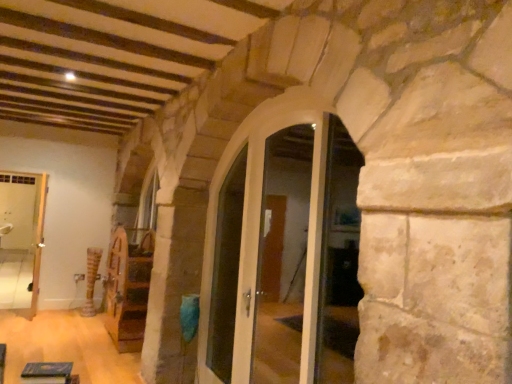
How much space does white glossy door at center, marked as the 2th glass door in a front-to-back arrangement, occupy vertically?

The height of white glossy door at center, marked as the 2th glass door in a front-to-back arrangement, is 1.97 meters.

What is the approximate width of wooden spinning wheel at center, placed as the second furniture when sorted from top to bottom?

wooden spinning wheel at center, placed as the second furniture when sorted from top to bottom, is 19.20 inches wide.

Consider the image. What is the approximate height of wooden spinning wheel at center, which is counted as the second furniture, starting from the front?

wooden spinning wheel at center, which is counted as the second furniture, starting from the front, is 1.34 meters tall.

In order to face clear glass door at center, which ranks as the second glass door in back-to-front order, should I rotate leftwards or rightwards?

Turn right by 0.703 degrees to look at clear glass door at center, which ranks as the second glass door in back-to-front order.

What do you see at coordinates (47, 373) in the screenshot? I see `green felt book at lower left, which ranks as the first furniture in top-to-bottom order` at bounding box center [47, 373].

What is the approximate width of green felt book at lower left, which ranks as the first furniture in top-to-bottom order?

13.06 inches.

What do you see at coordinates (21, 238) in the screenshot? I see `white glossy door at left` at bounding box center [21, 238].

Find the location of a particular element. This screenshot has width=512, height=384. white glossy door at left is located at coordinates (21, 238).

This screenshot has width=512, height=384. Identify the location of white glossy door at center, marked as the 2th glass door in a front-to-back arrangement. (283, 255).

What's the angular difference between wooden spinning wheel at center, placed as the first furniture when sorted from bottom to top, and wooden textured pillar at center's facing directions?

The facing directions of wooden spinning wheel at center, placed as the first furniture when sorted from bottom to top, and wooden textured pillar at center are 0.000208 degrees apart.

Considering the sizes of wooden spinning wheel at center, placed as the first furniture when sorted from bottom to top, and wooden textured pillar at center in the image, is wooden spinning wheel at center, placed as the first furniture when sorted from bottom to top, taller or shorter than wooden textured pillar at center?

Clearly, wooden spinning wheel at center, placed as the first furniture when sorted from bottom to top, is taller compared to wooden textured pillar at center.

Is the depth of wooden spinning wheel at center, which is counted as the second furniture, starting from the front, less than that of wooden textured pillar at center?

Yes.

Is wooden spinning wheel at center, positioned as the 1th furniture in back-to-front order, to the right of wooden textured pillar at center from the viewer's perspective?

Yes.

Is green felt book at lower left, which is counted as the 2th furniture, starting from the bottom, smaller than white glossy door at center?

Yes.

I want to click on the 1st furniture below the white glossy door at center (from the image's perspective), so click(x=47, y=373).

From the image's perspective, would you say green felt book at lower left, the second furniture when ordered from back to front, is positioned over white glossy door at center?

Actually, green felt book at lower left, the second furniture when ordered from back to front, appears below white glossy door at center in the image.

Is green felt book at lower left, which ranks as the first furniture in top-to-bottom order, not near white glossy door at center?

Yes, green felt book at lower left, which ranks as the first furniture in top-to-bottom order, is far from white glossy door at center.

Looking at this image, in the image, is wooden textured pillar at center on the left side or the right side of white glossy door at center, marked as the 2th glass door in a front-to-back arrangement?

In the image, wooden textured pillar at center appears on the left side of white glossy door at center, marked as the 2th glass door in a front-to-back arrangement.

Is wooden textured pillar at center placed right next to white glossy door at center, marked as the 2th glass door in a front-to-back arrangement?

No.

Between wooden textured pillar at center and white glossy door at center, the 1th glass door positioned from the back, which one has smaller width?

Thinner between the two is white glossy door at center, the 1th glass door positioned from the back.

Looking at this image, from a real-world perspective, is wooden textured pillar at center physically located above or below white glossy door at center, marked as the 2th glass door in a front-to-back arrangement?

From a real-world perspective, wooden textured pillar at center is physically below white glossy door at center, marked as the 2th glass door in a front-to-back arrangement.

Measure the distance from green felt book at lower left, which ranks as the first furniture in top-to-bottom order, to clear glass door at center, which ranks as the second glass door in back-to-front order.

A distance of 2.11 meters exists between green felt book at lower left, which ranks as the first furniture in top-to-bottom order, and clear glass door at center, which ranks as the second glass door in back-to-front order.

Does green felt book at lower left, which is counted as the 2th furniture, starting from the bottom, touch clear glass door at center, which appears as the 1th glass door when viewed from the front?

green felt book at lower left, which is counted as the 2th furniture, starting from the bottom, is not next to clear glass door at center, which appears as the 1th glass door when viewed from the front, and they're not touching.

Does point (49, 379) appear closer or farther from the camera than point (298, 334)?

Point (49, 379).

From the image's perspective, is wooden spinning wheel at center, positioned as the 1th furniture in back-to-front order, located beneath green felt book at lower left, which is counted as the 2th furniture, starting from the bottom?

Yes.

Which of these two, wooden spinning wheel at center, placed as the second furniture when sorted from top to bottom, or green felt book at lower left, the first furniture positioned from the front, is bigger?

wooden spinning wheel at center, placed as the second furniture when sorted from top to bottom.

How different are the orientations of wooden spinning wheel at center, positioned as the 1th furniture in back-to-front order, and green felt book at lower left, the second furniture when ordered from back to front, in degrees?

170 degrees.

In the scene shown: Between wooden spinning wheel at center, placed as the second furniture when sorted from top to bottom, and green felt book at lower left, the second furniture when ordered from back to front, which one has larger width?

With larger width is wooden spinning wheel at center, placed as the second furniture when sorted from top to bottom.

From the image's perspective, is white glossy door at center located above or below white glossy door at left?

white glossy door at center is situated higher than white glossy door at left in the image.

Based on the photo, is white glossy door at center at the right side of white glossy door at left?

Yes.

Which object is wider, white glossy door at center or white glossy door at left?

With larger width is white glossy door at center.

Is point (217, 294) positioned after point (30, 271)?

No, it is not.

Which point is more distant from viewer, (278, 334) or (92, 265)?

Point (92, 265)

Based on the photo, how different are the orientations of white glossy door at center, the 1th glass door positioned from the back, and wooden textured pillar at center in degrees?

The facing directions of white glossy door at center, the 1th glass door positioned from the back, and wooden textured pillar at center are 1.37 degrees apart.

Is wooden textured pillar at center inside white glossy door at center, marked as the 2th glass door in a front-to-back arrangement?

No, wooden textured pillar at center is not surrounded by white glossy door at center, marked as the 2th glass door in a front-to-back arrangement.

Is white glossy door at center, the 1th glass door positioned from the back, facing away from wooden textured pillar at center?

white glossy door at center, the 1th glass door positioned from the back, does not have its back to wooden textured pillar at center.

The height and width of the screenshot is (384, 512). In order to click on the 2nd furniture located above the wooden textured pillar at center (from a real-world perspective) in this screenshot , I will do `click(128, 287)`.

The width and height of the screenshot is (512, 384). There is a white glossy door at center. In order to click on the 1st furniture below it (from the image's perspective) in this screenshot , I will do `click(47, 373)`.

Consider the image. Based on their spatial positions, is wooden spinning wheel at center, placed as the second furniture when sorted from top to bottom, or white glossy door at center further from wooden textured pillar at center?

white glossy door at center lies further to wooden textured pillar at center than the other object.

Based on their spatial positions, is clear glass door at center, which appears as the 1th glass door when viewed from the front, or green felt book at lower left, which is counted as the 2th furniture, starting from the bottom, further from white glossy door at center?

The object further to white glossy door at center is green felt book at lower left, which is counted as the 2th furniture, starting from the bottom.

When comparing their distances from white glossy door at left, does wooden spinning wheel at center, positioned as the 1th furniture in back-to-front order, or wooden textured pillar at center seem further?

The object further to white glossy door at left is wooden spinning wheel at center, positioned as the 1th furniture in back-to-front order.

Which object lies nearer to the anchor point clear glass door at center, which ranks as the second glass door in back-to-front order, wooden spinning wheel at center, placed as the first furniture when sorted from bottom to top, or wooden textured pillar at center?

Among the two, wooden spinning wheel at center, placed as the first furniture when sorted from bottom to top, is located nearer to clear glass door at center, which ranks as the second glass door in back-to-front order.

Based on their spatial positions, is clear glass door at center, which ranks as the second glass door in back-to-front order, or white glossy door at center, the 1th glass door positioned from the back, further from white glossy door at center?

white glossy door at center, the 1th glass door positioned from the back, is positioned further to the anchor white glossy door at center.

Considering their positions, is white glossy door at center, the 1th glass door positioned from the back, positioned further to green felt book at lower left, the first furniture positioned from the front, than white glossy door at left?

white glossy door at center, the 1th glass door positioned from the back.

Estimate the real-world distances between objects in this image. Which object is closer to clear glass door at center, which ranks as the second glass door in back-to-front order, wooden textured pillar at center or green felt book at lower left, which ranks as the first furniture in top-to-bottom order?

green felt book at lower left, which ranks as the first furniture in top-to-bottom order.

Considering their positions, is white glossy door at center positioned closer to white glossy door at left than clear glass door at center, which appears as the 1th glass door when viewed from the front?

white glossy door at center is positioned closer to the anchor white glossy door at left.

Where is `passage located between clear glass door at center, which ranks as the second glass door in back-to-front order, and wooden textured pillar at center in the depth direction`? This screenshot has width=512, height=384. passage located between clear glass door at center, which ranks as the second glass door in back-to-front order, and wooden textured pillar at center in the depth direction is located at coordinates (21, 238).

Where is `glass door between green felt book at lower left, the first furniture positioned from the front, and wooden textured pillar at center in the front-back direction`? Image resolution: width=512 pixels, height=384 pixels. glass door between green felt book at lower left, the first furniture positioned from the front, and wooden textured pillar at center in the front-back direction is located at coordinates (283, 255).

Locate an element on the screen. The image size is (512, 384). furniture between green felt book at lower left, which ranks as the first furniture in top-to-bottom order, and white glossy door at left from front to back is located at coordinates (128, 287).

Locate an element on the screen. glass door between clear glass door at center, which appears as the 1th glass door when viewed from the front, and white glossy door at center from front to back is located at coordinates (283, 255).